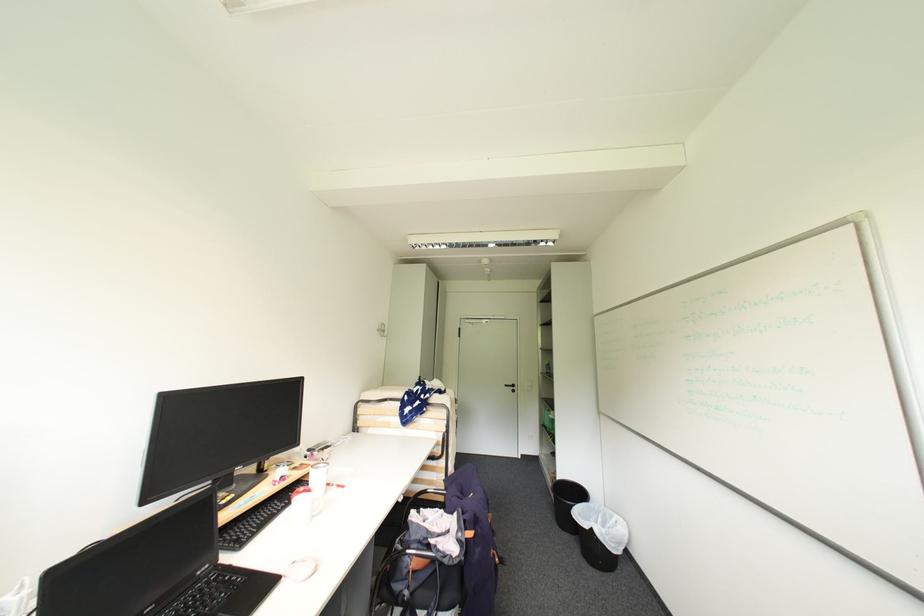
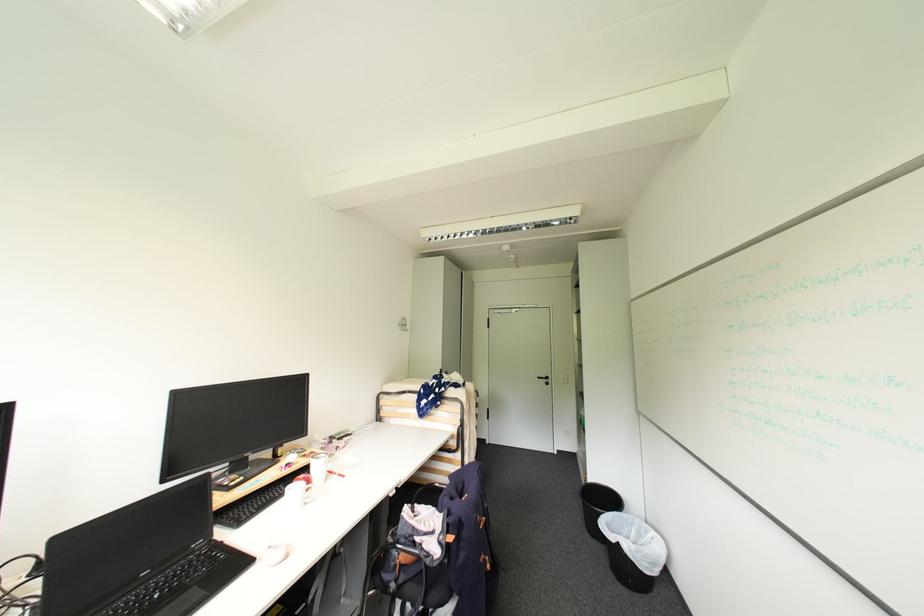
The point at (467, 536) is marked in the first image. Where is the corresponding point in the second image?

(447, 538)